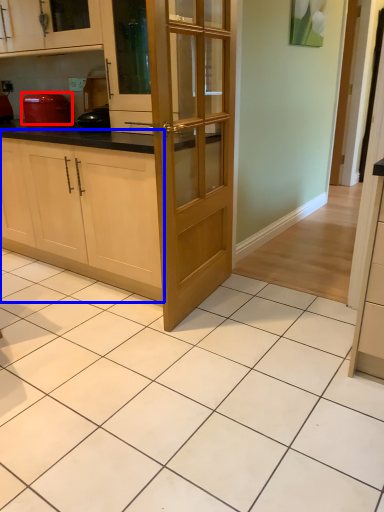
Question: Which object appears closest to the camera in this image, kitchen appliance (highlighted by a red box) or cabinetry (highlighted by a blue box)?

Choices:
 (A) kitchen appliance
 (B) cabinetry

Answer: (B)